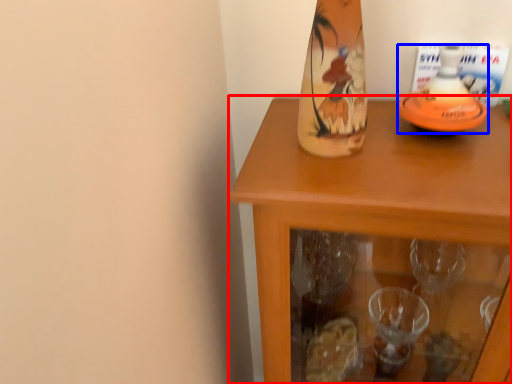
Question: Which point is closer to the camera, table (highlighted by a red box) or bottle (highlighted by a blue box)?

Choices:
 (A) table
 (B) bottle

Answer: (A)